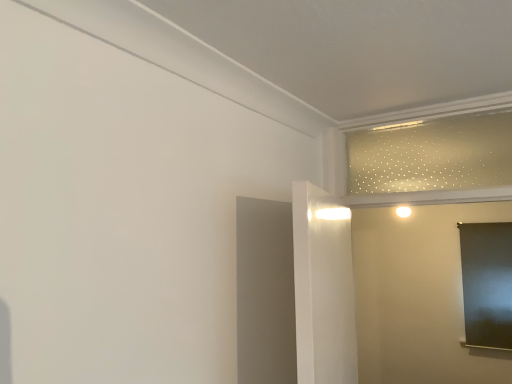
This screenshot has width=512, height=384. What do you see at coordinates (432, 154) in the screenshot?
I see `translucent frosted glass at upper right` at bounding box center [432, 154].

What is the approximate width of translucent frosted glass at upper right?

It is 2.96 inches.

In order to face translucent frosted glass at upper right, should I rotate leftwards or rightwards?

A 21.135 degree turn to the right will do.

Identify the location of translucent frosted glass at upper right. The image size is (512, 384). (432, 154).

Identify the location of translucent frosted glass at upper right. This screenshot has width=512, height=384. (432, 154).